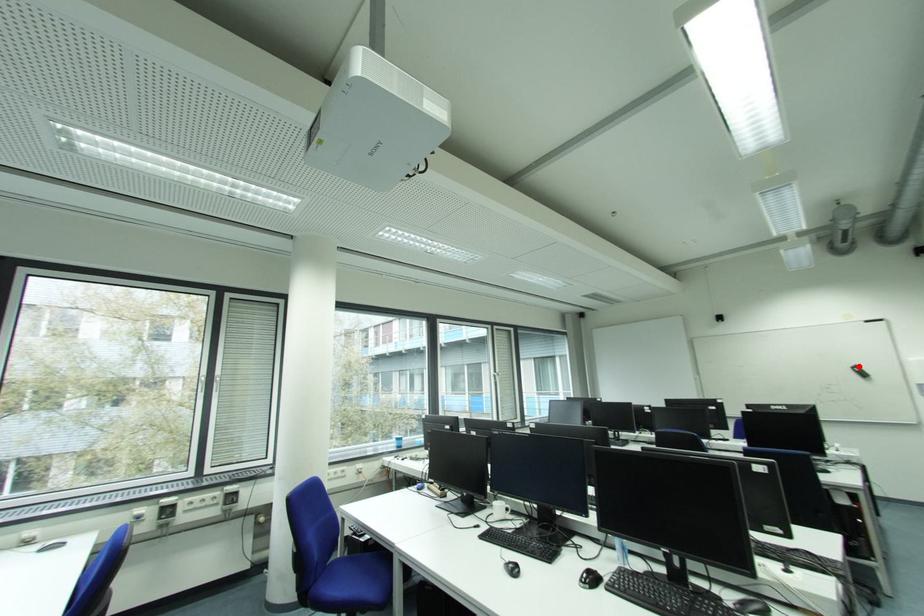
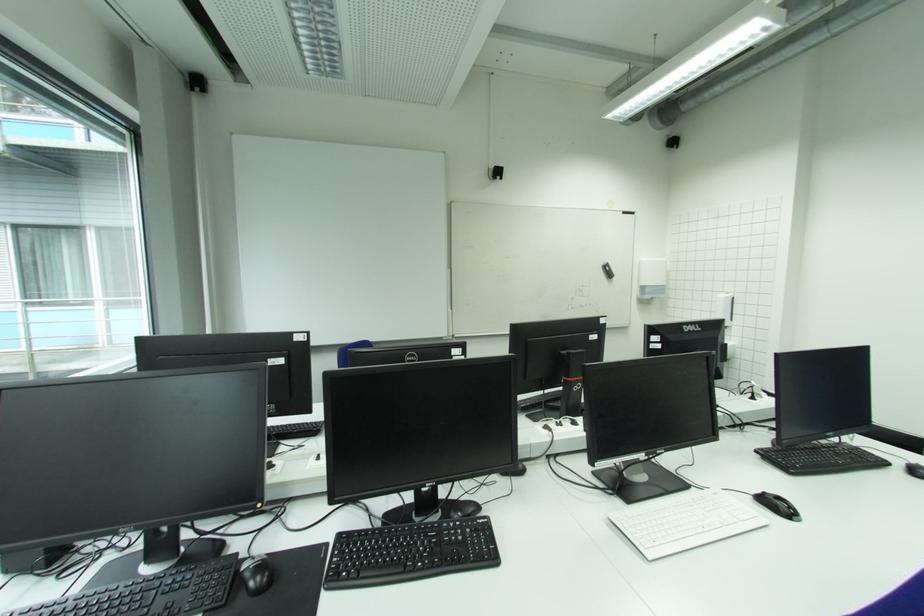
Locate, in the second image, the point that corresponds to the highlighted location in the first image.

(610, 264)